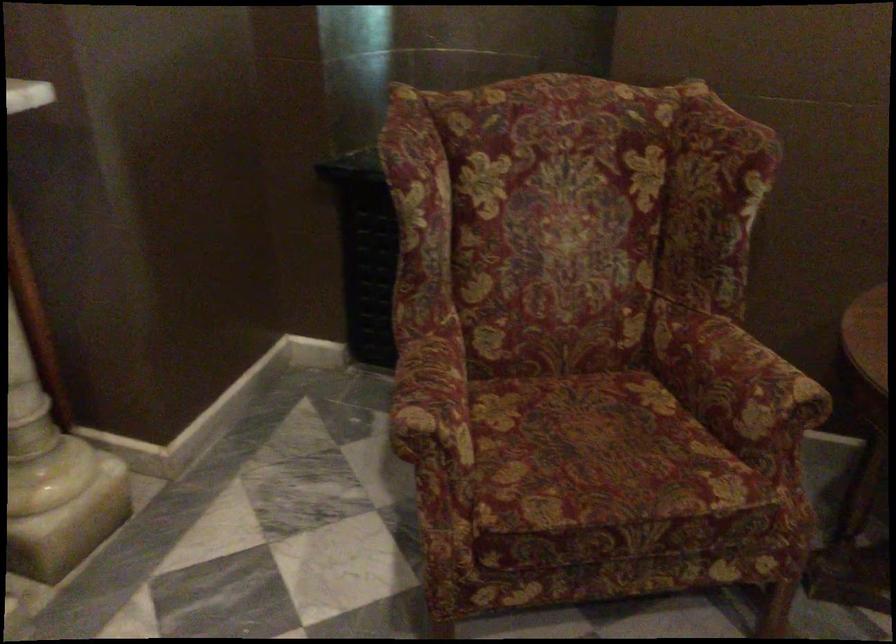
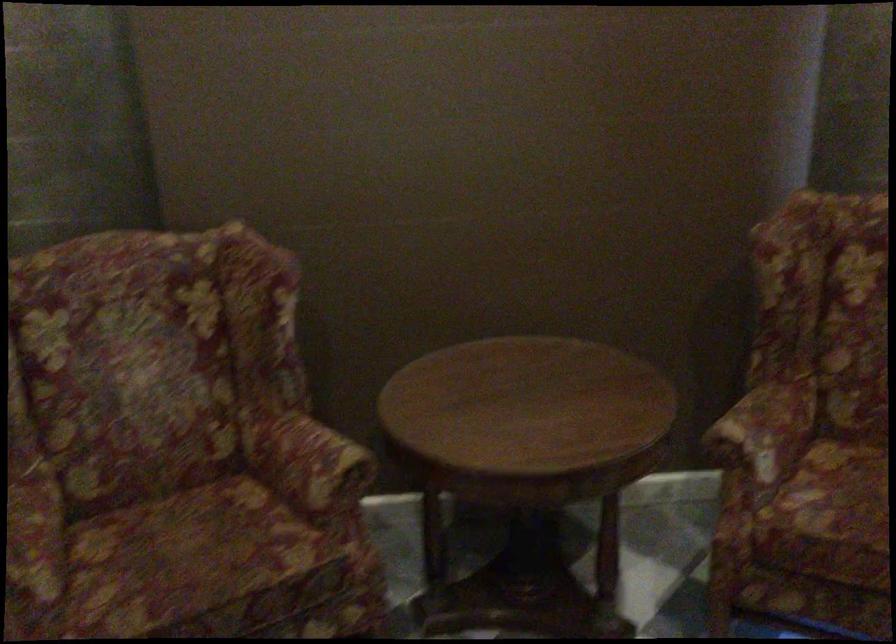
What movement of the cameraman would produce the second image?

The movement direction of the cameraman is right, backward.